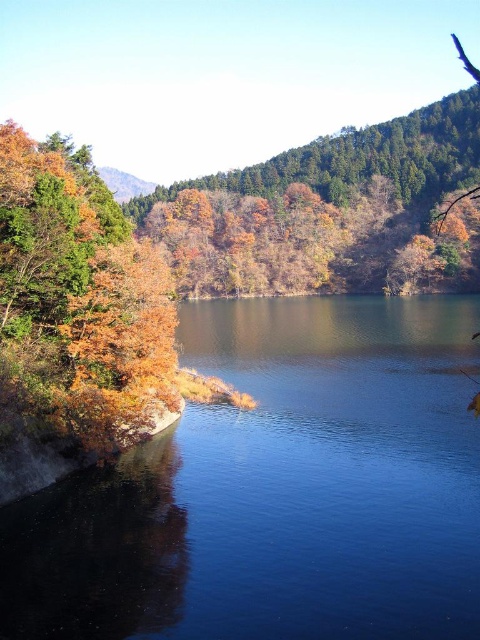
Question: Is blue smooth water at left thinner than autumn leaves at left?

Choices:
 (A) yes
 (B) no

Answer: (B)

Question: Observing the image, what is the correct spatial positioning of blue smooth water at left in reference to autumn leaves at left?

Choices:
 (A) below
 (B) above

Answer: (A)

Question: Estimate the real-world distances between objects in this image. Which object is farther from the autumn leaves at left?

Choices:
 (A) autumn leaves at center
 (B) blue smooth water at left

Answer: (A)

Question: Among these points, which one is farthest from the camera?

Choices:
 (A) (96, 188)
 (B) (334, 422)

Answer: (A)

Question: Which point is farther to the camera?

Choices:
 (A) autumn leaves at left
 (B) autumn leaves at center

Answer: (B)

Question: Does blue smooth water at left have a lesser width compared to autumn leaves at left?

Choices:
 (A) yes
 (B) no

Answer: (B)